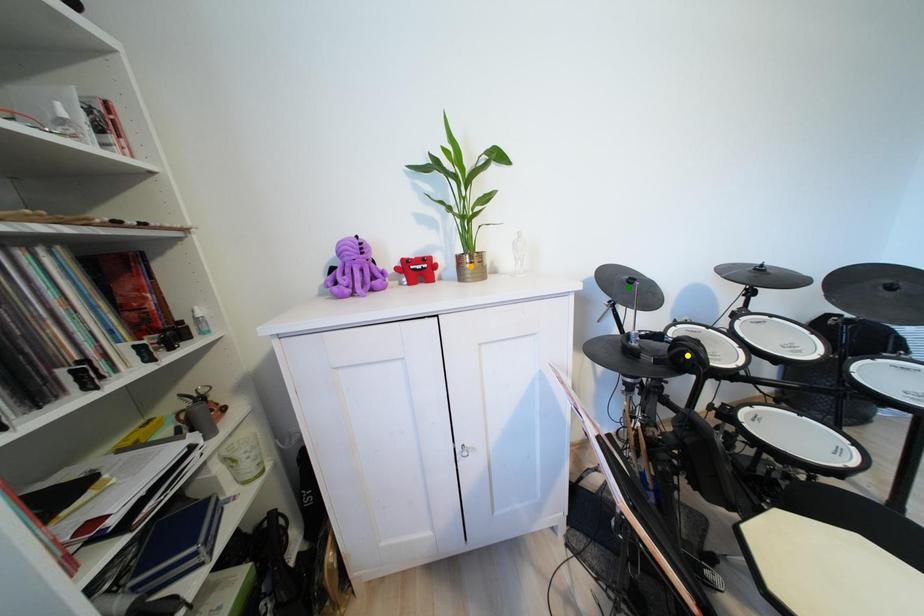
Order these from farthest to nearest:
- orange point
- green point
- yellow point

green point, orange point, yellow point